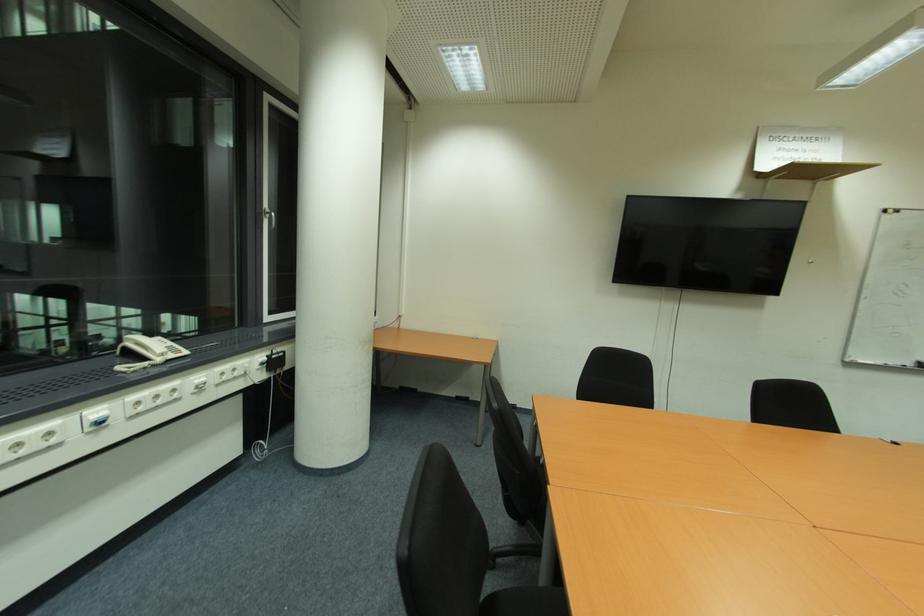
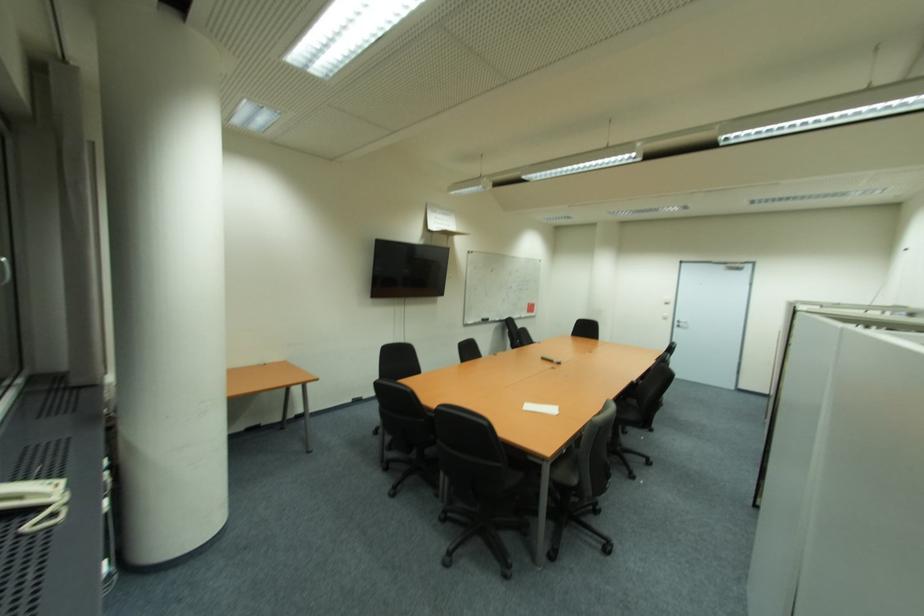
The point at (179, 354) is marked in the first image. Where is the corresponding point in the second image?

(57, 488)